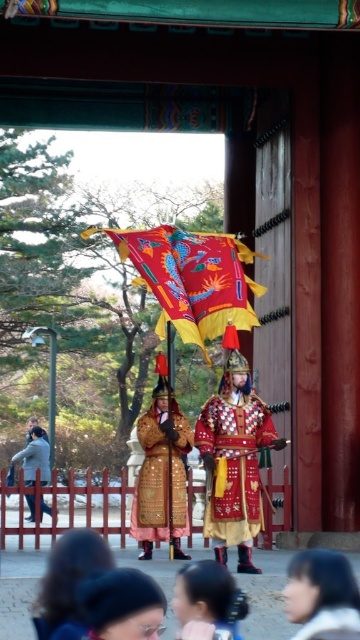
Looking at this image, does red velvet flag at center appear over matte black hair at lower center?

Yes.

Is red velvet flag at center in front of matte black hair at lower center?

That is False.

Between point (182, 310) and point (150, 616), which one is positioned behind?

Point (182, 310)

Find the location of a particular element. Image resolution: width=360 pixels, height=640 pixels. red velvet flag at center is located at coordinates (191, 278).

What do you see at coordinates (160, 474) in the screenshot? I see `gold textured robe at center` at bounding box center [160, 474].

Which of these two, gold textured robe at center or smooth brown hair at lower left, stands shorter?

With less height is smooth brown hair at lower left.

At what (x,y) coordinates should I click in order to perform the action: click on gold textured robe at center. Please return your answer as a coordinate pair (x, y). Looking at the image, I should click on (160, 474).

At what (x,y) coordinates should I click in order to perform the action: click on gold textured robe at center. Please return your answer as a coordinate pair (x, y). Image resolution: width=360 pixels, height=640 pixels. Looking at the image, I should click on (160, 474).

Is point (239, 477) positioned behind point (221, 579)?

Yes, it is behind point (221, 579).

At what (x,y) coordinates should I click in order to perform the action: click on embroidered silk robe at center. Please return your answer as a coordinate pair (x, y). The image size is (360, 640). Looking at the image, I should click on (232, 465).